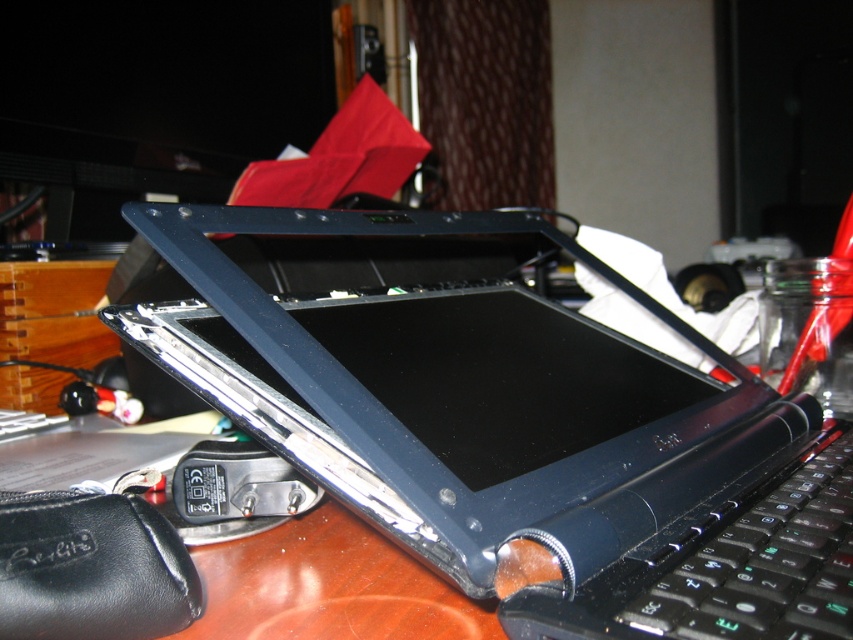
You are a technician trying to assemble the laptop. You need to place a component at the point exactly 14 inches away from your view. Can you confirm if the point at (601, 512) is suitable for placing the component?

Yes, the point at (601, 512) is exactly 14.03 inches from the viewer, which is within the required 14 inches distance for placing the component.

You are a technician trying to place the satin black laptop at center and the black matte keyboard at lower right onto a shelf. The shelf has a width of 50 cm. If the keyboard takes up 20 cm of space, will both items fit side by side on the shelf?

The satin black laptop at center is wider than the black matte keyboard at lower right. Since the keyboard occupies 20 cm, the laptop requires more than 20 cm. Adding both would exceed the shelf width of 50 cm, so they won

You are a technician working on a desk. You have a satin black laptop at center and a black matte keyboard at lower right. You need to place a 6 inch long tool between them. Can you fit it without moving either object?

The distance between the satin black laptop at center and the black matte keyboard at lower right is 5.44 inches. Since the tool is 6 inches long, it cannot fit in the space between them without moving either object.